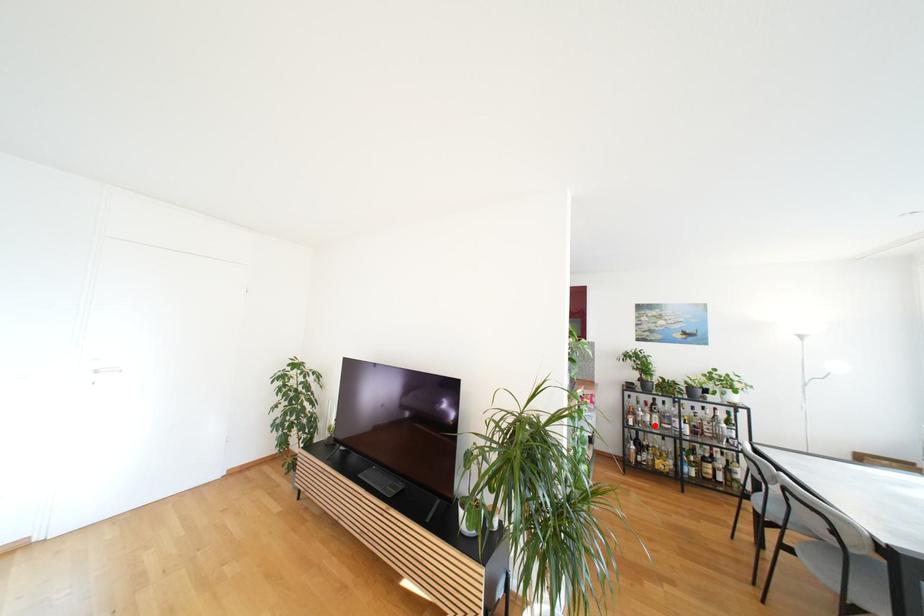
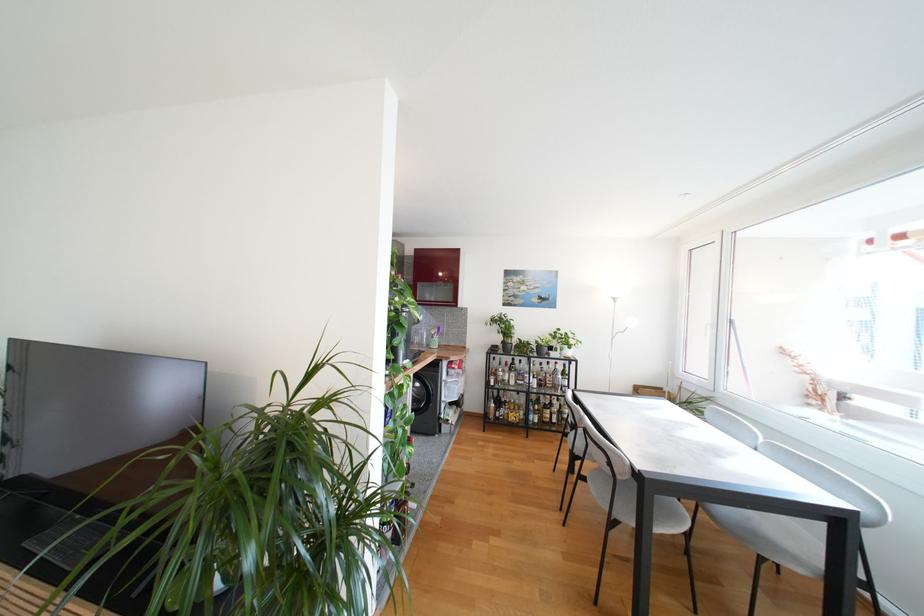
Locate, in the second image, the point that corresponds to the highlighted location in the first image.

(513, 383)